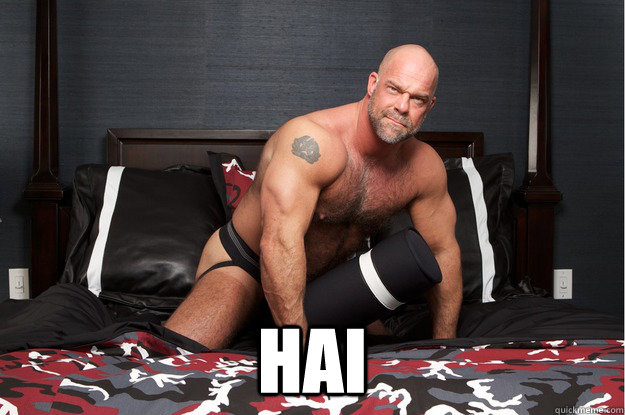
This screenshot has height=415, width=625. Identify the location of pillow. (498, 237), (175, 199).